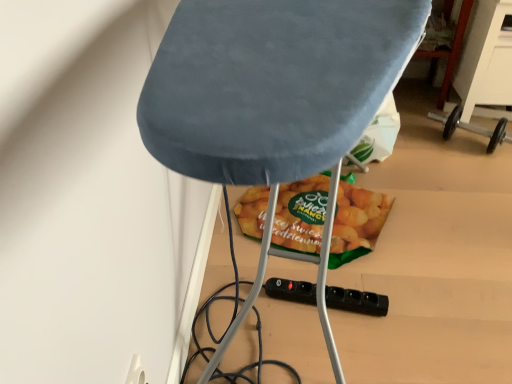
What are the coordinates of `free spot to the right of green matte snack at center` in the screenshot? It's located at (445, 215).